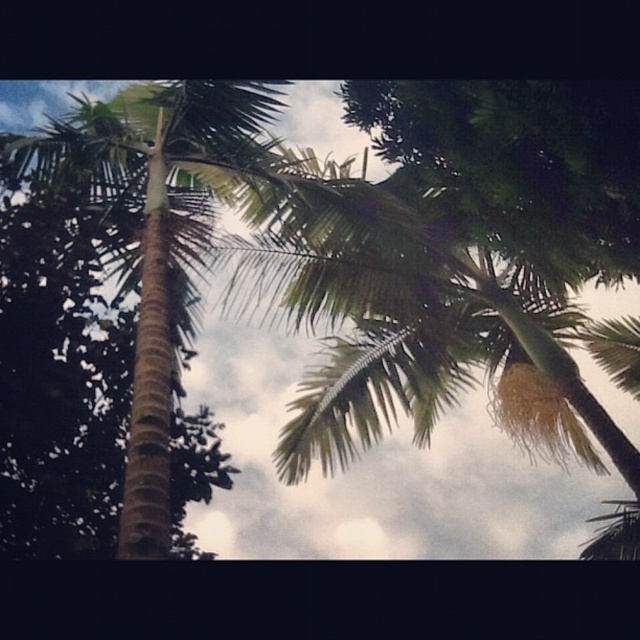
You are standing under the palm tree and looking up. There are two points marked on the trunk. One is at coordinate point (419,262) and the other at point (163,202). Which point is closer to the top of the palm tree?

Point (419,262) is behind point (163,202), so it is closer to the top of the palm tree.